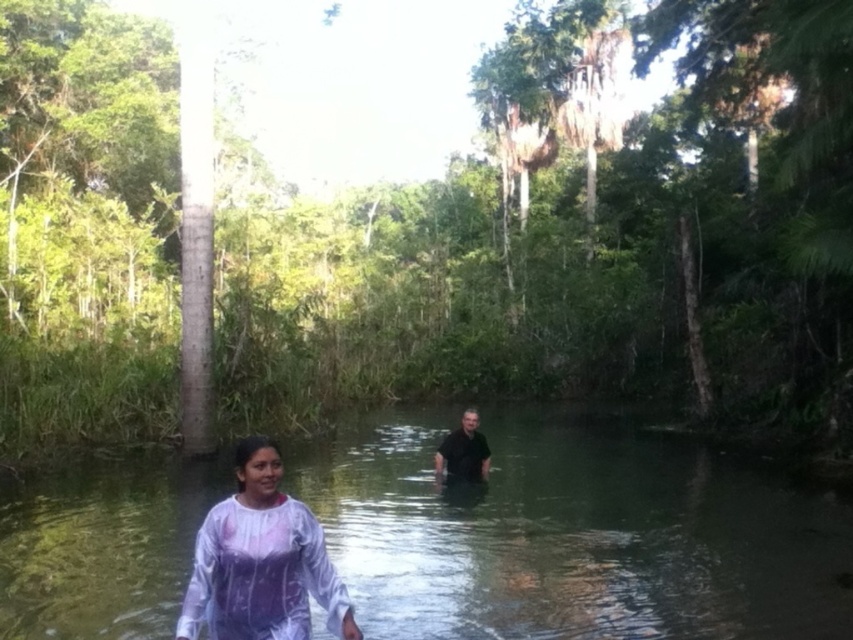
You are planning to take a photo of the clear water at center and the white matte dress at center. Which object should you focus on to ensure it fills more of the frame?

The clear water at center is bigger than the white matte dress at center, so focusing on the clear water at center will fill more of the frame.

You are planning to cross the stream shown in the image. You see the white matte dress at center and the black matte shirt at center. Which clothing item has a larger width and could potentially be more stable to step on if they are submerged?

The white matte dress at center has a larger width than the black matte shirt at center, so it could potentially be more stable to step on if they are submerged.